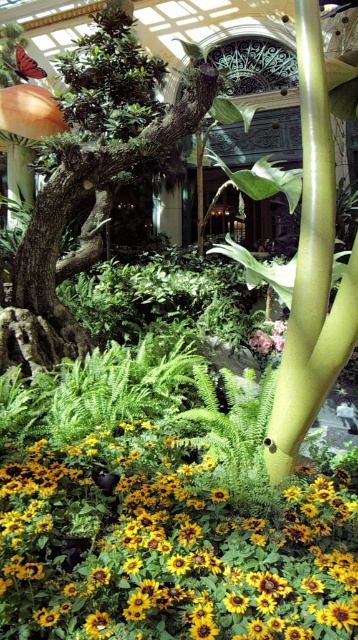
Question: Which of these objects is positioned closest to the green textured tree at center?

Choices:
 (A) pink matte flower at center
 (B) yellow matte flower at center

Answer: (A)

Question: From the image, what is the correct spatial relationship of yellow matte flower at center in relation to green textured tree at center?

Choices:
 (A) above
 (B) below

Answer: (B)

Question: Which point is farther to the camera?

Choices:
 (A) yellow matte flower at center
 (B) pink matte flower at center

Answer: (B)

Question: Which point is closer to the camera?

Choices:
 (A) yellow matte flower at center
 (B) pink matte flower at center

Answer: (A)

Question: Is yellow matte flower at center smaller than green textured tree at center?

Choices:
 (A) no
 (B) yes

Answer: (A)

Question: Observing the image, what is the correct spatial positioning of yellow matte flower at center in reference to green textured tree at center?

Choices:
 (A) below
 (B) above

Answer: (A)